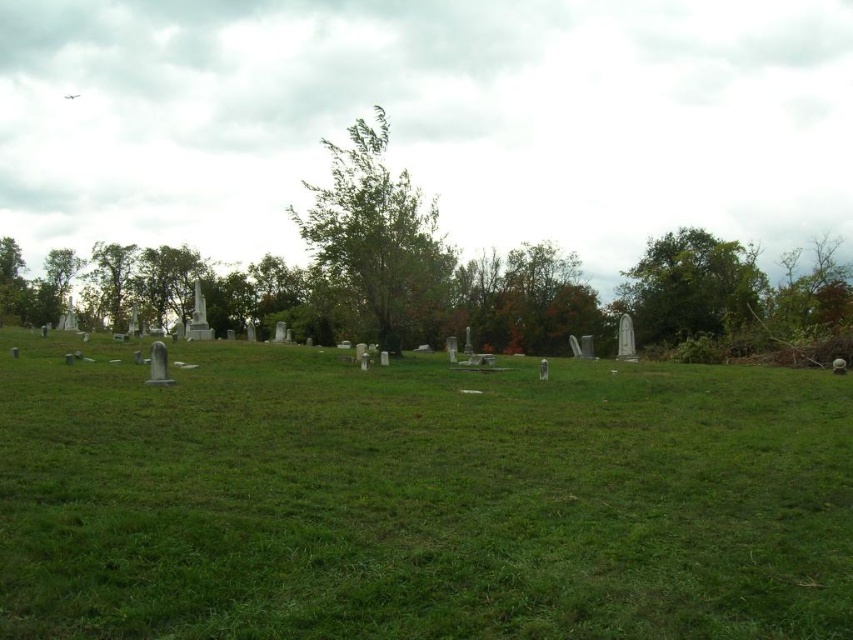
Is point (431, 257) in front of point (711, 310)?

Yes, it is in front of point (711, 310).

Can you confirm if green leafy tree at center is positioned to the left of green leafy tree at upper right?

Indeed, green leafy tree at center is positioned on the left side of green leafy tree at upper right.

Is point (399, 285) positioned in front of point (671, 330)?

Yes, point (399, 285) is closer to viewer.

Where is `green leafy tree at center`? This screenshot has height=640, width=853. green leafy tree at center is located at coordinates (376, 234).

Which is behind, point (811, 596) or point (653, 289)?

The point (653, 289) is more distant.

Is green grassy field at center above green leafy tree at upper right?

Actually, green grassy field at center is below green leafy tree at upper right.

Who is more distant from viewer, [810,636] or [645,266]?

The point [645,266] is behind.

Find the location of a particular element. green grassy field at center is located at coordinates (418, 499).

Is green grassy field at center below green leafy tree at center?

Indeed, green grassy field at center is positioned under green leafy tree at center.

Can you confirm if green grassy field at center is positioned to the left of green leafy tree at center?

In fact, green grassy field at center is to the right of green leafy tree at center.

You are a GUI agent. You are given a task and a screenshot of the screen. Output one action in this format:
    pyautogui.click(x=<x>, y=<y>)
    Task: Click on the green grassy field at center
    
    Given the screenshot: What is the action you would take?
    pyautogui.click(x=418, y=499)